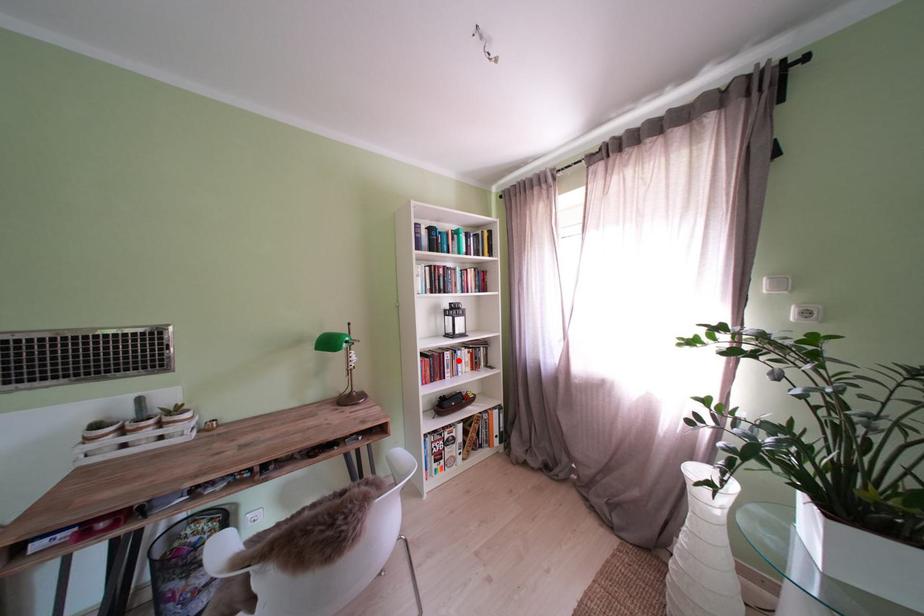
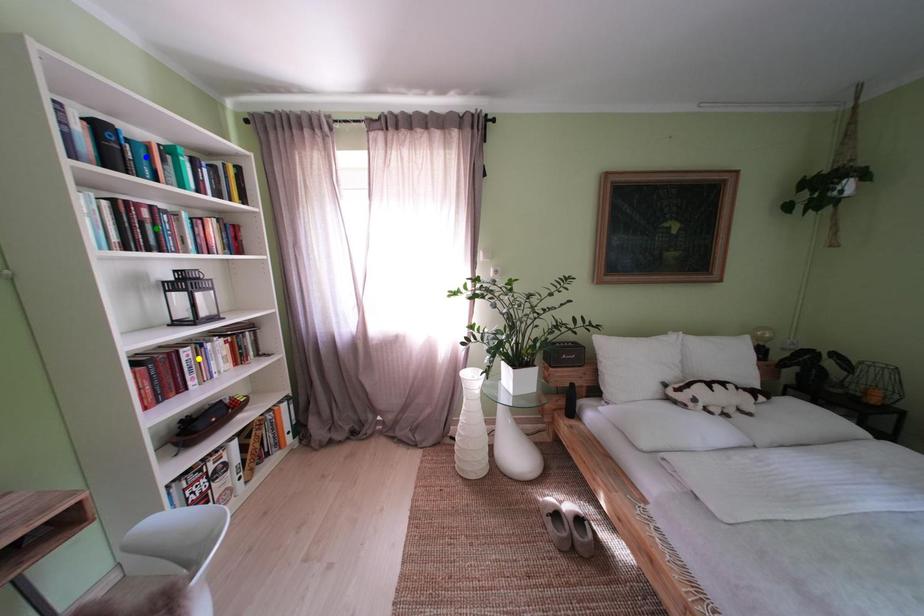
Question: I am providing you with two images of the same scene from different viewpoints. A red point is marked on the first image. You are given multiple points on the second image. In image 2, which mark is for the same physical point as the one in image 1?

Choices:
 (A) blue point
 (B) yellow point
 (C) green point

Answer: (B)